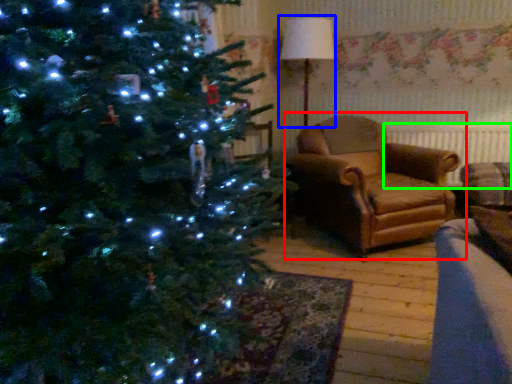
Question: Estimate the real-world distances between objects in this image. Which object is farther from studio couch (highlighted by a red box), lamp (highlighted by a blue box) or radiator (highlighted by a green box)?

Choices:
 (A) lamp
 (B) radiator

Answer: (A)